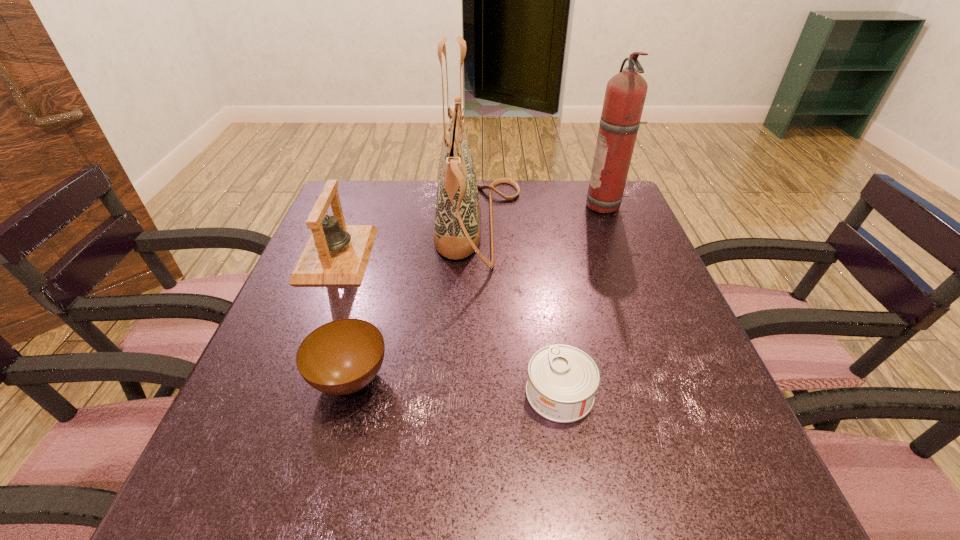
Where is `free space between the bowl and the third shortest object`? free space between the bowl and the third shortest object is located at coordinates (344, 317).

Locate an element on the screen. vacant space in between the can and the third shortest object is located at coordinates (448, 323).

Identify the location of free area in between the bowl and the handbag. The width and height of the screenshot is (960, 540). (415, 302).

Locate an element on the screen. This screenshot has height=540, width=960. object that is the third closest to the bell is located at coordinates (562, 381).

Select which object appears as the second closest to the fire extinguisher. Please provide its 2D coordinates. Your answer should be formatted as a tuple, i.e. [(x, y)], where the tuple contains the x and y coordinates of a point satisfying the conditions above.

[(562, 381)]

Image resolution: width=960 pixels, height=540 pixels. Identify the location of free region that satisfies the following two spatial constraints: 1. on the back side of the shortest object; 2. on the front-facing side of the handbag. (533, 226).

This screenshot has width=960, height=540. I want to click on free point that satisfies the following two spatial constraints: 1. on the front-facing side of the handbag; 2. on the back side of the can, so click(x=480, y=393).

The image size is (960, 540). In order to click on free spot that satisfies the following two spatial constraints: 1. on the front-facing side of the handbag; 2. on the right side of the can in this screenshot , I will do `click(480, 393)`.